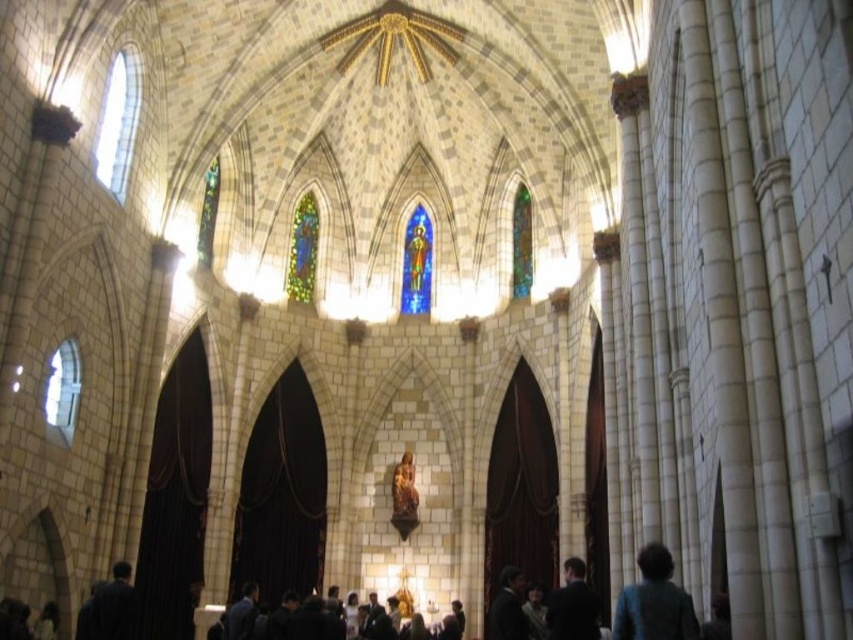
Between clear glass window at lower left and multicolored stained glass at upper center, which one is positioned lower?

clear glass window at lower left is lower down.

Who is shorter, clear glass window at lower left or multicolored stained glass at upper center?

With less height is clear glass window at lower left.

The height and width of the screenshot is (640, 853). What do you see at coordinates (62, 388) in the screenshot? I see `clear glass window at lower left` at bounding box center [62, 388].

At what (x,y) coordinates should I click in order to perform the action: click on clear glass window at lower left. Please return your answer as a coordinate pair (x, y). This screenshot has width=853, height=640. Looking at the image, I should click on (62, 388).

In the scene shown: Is clear glass window at upper left below dark suit jackets at center?

No.

Find the location of a particular element. The width and height of the screenshot is (853, 640). clear glass window at upper left is located at coordinates (117, 124).

Who is more forward, (109, 180) or (418, 632)?

Point (109, 180) is in front.

The image size is (853, 640). I want to click on clear glass window at upper left, so click(117, 124).

Does multicolored stained glass at upper center have a larger size compared to emerald stained glass at upper left?

Indeed, multicolored stained glass at upper center has a larger size compared to emerald stained glass at upper left.

Is multicolored stained glass at upper center smaller than emerald stained glass at upper left?

No, multicolored stained glass at upper center is not smaller than emerald stained glass at upper left.

The width and height of the screenshot is (853, 640). What do you see at coordinates (521, 243) in the screenshot?
I see `multicolored stained glass at upper center` at bounding box center [521, 243].

Where is `multicolored stained glass at upper center`? This screenshot has height=640, width=853. multicolored stained glass at upper center is located at coordinates (521, 243).